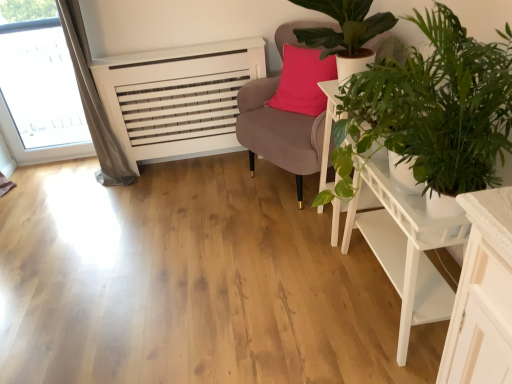
This screenshot has height=384, width=512. What are the coordinates of `velvet pink chair at upper right` in the screenshot? It's located at (278, 132).

Describe the element at coordinates (329, 132) in the screenshot. The height and width of the screenshot is (384, 512). I see `white wooden side table at center right` at that location.

Where is `white wooden side table at center right`? The width and height of the screenshot is (512, 384). white wooden side table at center right is located at coordinates (329, 132).

Locate an element on the screen. This screenshot has height=384, width=512. green leafy plant at upper right, which is counted as the second houseplant, starting from the front is located at coordinates (345, 32).

You are a GUI agent. You are given a task and a screenshot of the screen. Output one action in this format:
    pyautogui.click(x=<x>, y=<y>)
    Task: Click on the green leafy plant at right, positioned as the 1th houseplant in front-to-back order
    
    Given the screenshot: What is the action you would take?
    pyautogui.click(x=432, y=109)

From a real-world perspective, which is physically above, white wooden side table at center right or white wooden table at lower right?

From a 3D spatial view, white wooden side table at center right is above.

Between white wooden side table at center right and white wooden table at lower right, which one has smaller size?

With smaller size is white wooden side table at center right.

Which is closer to the camera, (335, 217) or (396, 203)?

Point (335, 217).

Between white wooden side table at center right and white wooden table at lower right, which one has less height?

white wooden table at lower right is shorter.

In the image, there is a green leafy plant at upper right, the first houseplant viewed from the back. Identify the location of table below it (from the image's perspective). (402, 245).

Considering the positions of point (388, 275) and point (370, 24), is point (388, 275) closer or farther from the camera than point (370, 24)?

Point (388, 275) is positioned farther from the camera compared to point (370, 24).

From a real-world perspective, who is located higher, white wooden table at lower right or green leafy plant at upper right, the first houseplant viewed from the back?

green leafy plant at upper right, the first houseplant viewed from the back.

Does white wooden table at lower right appear on the right side of green leafy plant at upper right, which is counted as the second houseplant, starting from the front?

Indeed, white wooden table at lower right is positioned on the right side of green leafy plant at upper right, which is counted as the second houseplant, starting from the front.

Between point (475, 163) and point (362, 59), which one is positioned behind?

The point (362, 59) is farther.

Is green leafy plant at right, positioned as the 1th houseplant in front-to-back order, further to the viewer compared to green leafy plant at upper right, the first houseplant viewed from the back?

No, the depth of green leafy plant at right, positioned as the 1th houseplant in front-to-back order, is less than that of green leafy plant at upper right, the first houseplant viewed from the back.

Is green leafy plant at right, positioned as the 1th houseplant in front-to-back order, in contact with green leafy plant at upper right, which is counted as the second houseplant, starting from the front?

No, green leafy plant at right, positioned as the 1th houseplant in front-to-back order, is not with green leafy plant at upper right, which is counted as the second houseplant, starting from the front.

Identify the location of houseplant positioned vertically above the green leafy plant at right, positioned as the 1th houseplant in front-to-back order (from a real-world perspective). (345, 32).

Consider the image. Are white wooden table at lower right and green leafy plant at right, positioned as the 1th houseplant in front-to-back order, located far from each other?

Actually, white wooden table at lower right and green leafy plant at right, positioned as the 1th houseplant in front-to-back order, are a little close together.

Locate an element on the screen. table that is behind the green leafy plant at right, the 2th houseplant viewed from the back is located at coordinates (402, 245).

Which of these two, white wooden table at lower right or green leafy plant at right, the 2th houseplant viewed from the back, stands taller?

white wooden table at lower right is taller.

From the picture: Is green leafy plant at right, positioned as the 1th houseplant in front-to-back order, completely or partially inside white wooden table at lower right?

No.

Between white wooden side table at center right and green leafy plant at right, the 2th houseplant viewed from the back, which one has less height?

With less height is green leafy plant at right, the 2th houseplant viewed from the back.

Is the position of white wooden side table at center right less distant than that of green leafy plant at right, positioned as the 1th houseplant in front-to-back order?

No, white wooden side table at center right is further to the viewer.

Is white wooden side table at center right bigger than green leafy plant at right, positioned as the 1th houseplant in front-to-back order?

Actually, white wooden side table at center right might be smaller than green leafy plant at right, positioned as the 1th houseplant in front-to-back order.

Considering the relative sizes of white wooden side table at center right and green leafy plant at right, the 2th houseplant viewed from the back, in the image provided, is white wooden side table at center right wider than green leafy plant at right, the 2th houseplant viewed from the back,?

No.

Which is correct: white wooden side table at center right is inside green leafy plant at upper right, which is counted as the second houseplant, starting from the front, or outside of it?

white wooden side table at center right is not enclosed by green leafy plant at upper right, which is counted as the second houseplant, starting from the front.

Which object is positioned more to the right, white wooden side table at center right or green leafy plant at upper right, the first houseplant viewed from the back?

white wooden side table at center right.

Considering the points (333, 189) and (354, 12), which point is in front, point (333, 189) or point (354, 12)?

Point (354, 12)

Locate an element on the screen. Image resolution: width=512 pixels, height=384 pixels. houseplant above the white wooden side table at center right (from the image's perspective) is located at coordinates 345,32.

Looking at this image, is green leafy plant at right, the 2th houseplant viewed from the back, smaller than transparent glass window at upper left?

No.

Between point (425, 180) and point (41, 94), which one is positioned in front?

The point (425, 180) is closer.

Is transparent glass window at upper left completely or partially inside green leafy plant at right, the 2th houseplant viewed from the back?

That's incorrect, transparent glass window at upper left is not inside green leafy plant at right, the 2th houseplant viewed from the back.

Is green leafy plant at right, the 2th houseplant viewed from the back, turned away from transparent glass window at upper left?

No, green leafy plant at right, the 2th houseplant viewed from the back, is not facing the opposite direction of transparent glass window at upper left.

Identify the location of table in front of the white wooden side table at center right. This screenshot has height=384, width=512. (402, 245).

From the image's perspective, which houseplant is the 2nd one above the white wooden table at lower right? Please provide its 2D coordinates.

[(345, 32)]

When comparing their distances from green leafy plant at upper right, which is counted as the second houseplant, starting from the front, does white wooden side table at center right or green leafy plant at right, positioned as the 1th houseplant in front-to-back order, seem closer?

white wooden side table at center right is positioned closer to the anchor green leafy plant at upper right, which is counted as the second houseplant, starting from the front.

Considering their positions, is green leafy plant at right, positioned as the 1th houseplant in front-to-back order, positioned closer to transparent glass window at upper left than green leafy plant at upper right, which is counted as the second houseplant, starting from the front?

green leafy plant at upper right, which is counted as the second houseplant, starting from the front, is positioned closer to the anchor transparent glass window at upper left.

Based on their spatial positions, is transparent glass window at upper left or white wooden side table at center right further from green leafy plant at upper right, the first houseplant viewed from the back?

transparent glass window at upper left.

Which object lies further to the anchor point white wooden side table at center right, green leafy plant at right, the 2th houseplant viewed from the back, or transparent glass window at upper left?

transparent glass window at upper left is positioned further to the anchor white wooden side table at center right.

Based on the photo, from the image, which object appears to be farther from green leafy plant at right, the 2th houseplant viewed from the back, green leafy plant at upper right, the first houseplant viewed from the back, or white wooden side table at center right?

green leafy plant at upper right, the first houseplant viewed from the back.

Which object lies further to the anchor point white wooden table at lower right, transparent glass window at upper left or velvet pink chair at upper right?

transparent glass window at upper left is further to white wooden table at lower right.

From the image, which object appears to be nearer to velvet pink chair at upper right, white wooden side table at center right or white wooden table at lower right?

Among the two, white wooden side table at center right is located nearer to velvet pink chair at upper right.

When comparing their distances from green leafy plant at upper right, the first houseplant viewed from the back, does green leafy plant at right, positioned as the 1th houseplant in front-to-back order, or white wooden table at lower right seem further?

green leafy plant at right, positioned as the 1th houseplant in front-to-back order, is positioned further to the anchor green leafy plant at upper right, the first houseplant viewed from the back.

Find the location of a particular element. The height and width of the screenshot is (384, 512). chair located between transparent glass window at upper left and green leafy plant at right, positioned as the 1th houseplant in front-to-back order, in the left-right direction is located at coordinates (278, 132).

Find the location of `chair situated between transparent glass window at upper left and white wooden side table at center right from left to right`. chair situated between transparent glass window at upper left and white wooden side table at center right from left to right is located at coordinates (278, 132).

You are a GUI agent. You are given a task and a screenshot of the screen. Output one action in this format:
    pyautogui.click(x=<x>, y=<y>)
    Task: Click on the houseplant between green leafy plant at right, the 2th houseplant viewed from the back, and velvet pink chair at upper right in the front-back direction
    
    Given the screenshot: What is the action you would take?
    pyautogui.click(x=345, y=32)

The image size is (512, 384). I want to click on chair between green leafy plant at upper right, the first houseplant viewed from the back, and white wooden table at lower right, in the vertical direction, so click(x=278, y=132).